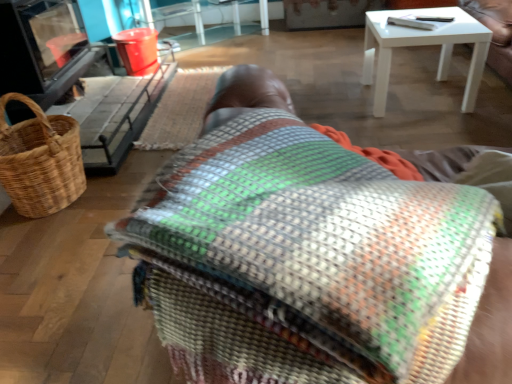
Question: Is brown woven picnic basket at left facing away from multicolored woven blanket at center?

Choices:
 (A) yes
 (B) no

Answer: (B)

Question: Can you see brown woven picnic basket at left touching multicolored woven blanket at center?

Choices:
 (A) no
 (B) yes

Answer: (A)

Question: Is brown woven picnic basket at left bigger than multicolored woven blanket at center?

Choices:
 (A) no
 (B) yes

Answer: (A)

Question: Is brown woven picnic basket at left wider than multicolored woven blanket at center?

Choices:
 (A) no
 (B) yes

Answer: (A)

Question: From the image's perspective, would you say brown woven picnic basket at left is shown under multicolored woven blanket at center?

Choices:
 (A) yes
 (B) no

Answer: (B)

Question: In terms of height, does woven fabric mat at upper center look taller or shorter compared to translucent plastic table at upper center?

Choices:
 (A) short
 (B) tall

Answer: (A)

Question: In terms of width, does woven fabric mat at upper center look wider or thinner when compared to translucent plastic table at upper center?

Choices:
 (A) thin
 (B) wide

Answer: (A)

Question: From the image's perspective, is woven fabric mat at upper center above or below translucent plastic table at upper center?

Choices:
 (A) below
 (B) above

Answer: (A)

Question: Considering the relative positions of woven fabric mat at upper center and translucent plastic table at upper center in the image provided, is woven fabric mat at upper center to the left or to the right of translucent plastic table at upper center?

Choices:
 (A) right
 (B) left

Answer: (A)

Question: Is woven fabric mat at upper center taller or shorter than multicolored woven blanket at center?

Choices:
 (A) tall
 (B) short

Answer: (B)

Question: Based on their sizes in the image, would you say woven fabric mat at upper center is bigger or smaller than multicolored woven blanket at center?

Choices:
 (A) big
 (B) small

Answer: (B)

Question: From a real-world perspective, is woven fabric mat at upper center physically located above or below multicolored woven blanket at center?

Choices:
 (A) below
 (B) above

Answer: (A)

Question: Considering their positions, is woven fabric mat at upper center located in front of or behind multicolored woven blanket at center?

Choices:
 (A) behind
 (B) front

Answer: (A)

Question: Visually, is translucent plastic table at upper center positioned to the left or to the right of woven fabric mat at upper center?

Choices:
 (A) left
 (B) right

Answer: (A)

Question: Considering the positions of translucent plastic table at upper center and woven fabric mat at upper center in the image, is translucent plastic table at upper center taller or shorter than woven fabric mat at upper center?

Choices:
 (A) tall
 (B) short

Answer: (A)